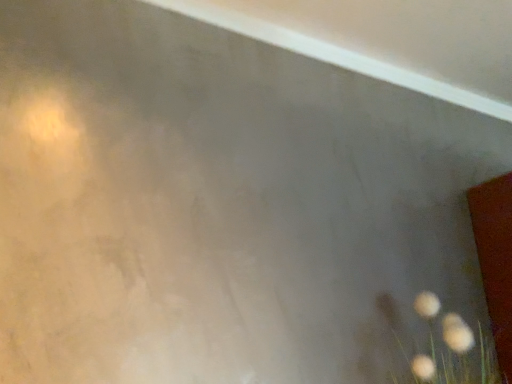
The height and width of the screenshot is (384, 512). What do you see at coordinates (388, 40) in the screenshot? I see `white glossy window sill at upper center` at bounding box center [388, 40].

This screenshot has height=384, width=512. I want to click on white glossy window sill at upper center, so click(388, 40).

The width and height of the screenshot is (512, 384). I want to click on white glossy window sill at upper center, so click(388, 40).